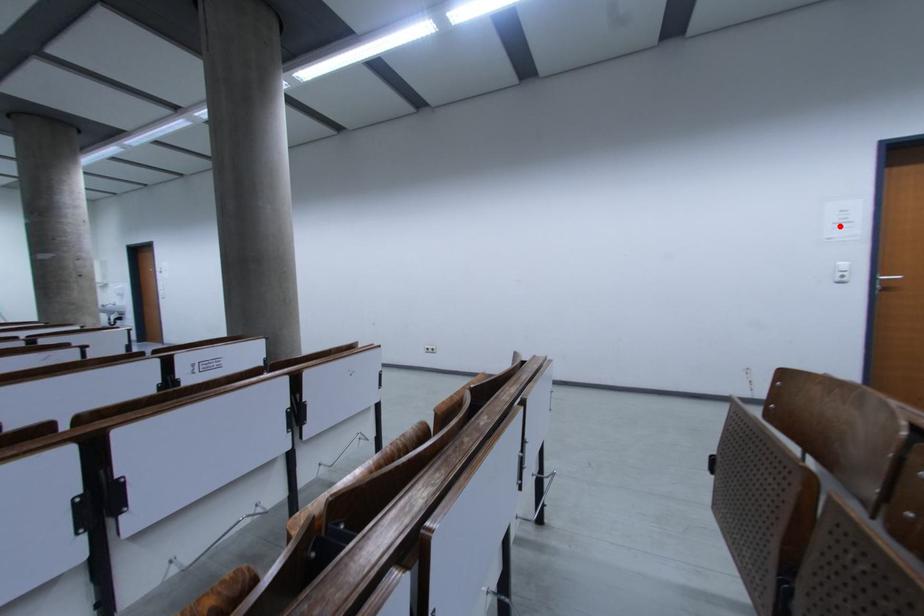
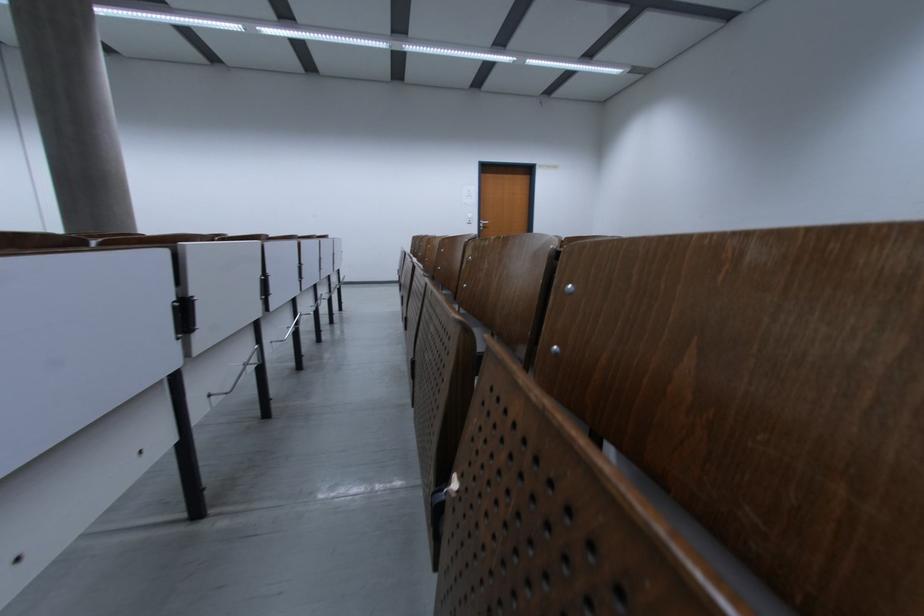
Question: A red point is marked in image1. In image2, is the corresponding 3D point closer to the camera or farther? Reply with the corresponding letter.

Choices:
 (A) The corresponding 3D point is closer.
 (B) The corresponding 3D point is farther.

Answer: (A)